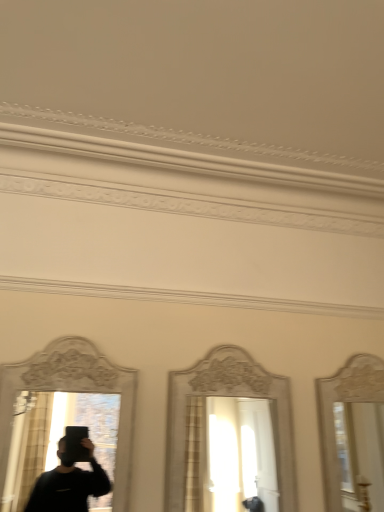
Question: Relative to matte white mirror at left, positioned as the 1th mirror in left-to-right order, is white glossy mirror at center, the second mirror positioned from the left, in front or behind?

Choices:
 (A) front
 (B) behind

Answer: (B)

Question: From a real-world perspective, relative to matte white mirror at left, which is counted as the 2th mirror, starting from the right, is white glossy mirror at center, marked as the 1th mirror in a right-to-left arrangement, vertically above or below?

Choices:
 (A) below
 (B) above

Answer: (A)

Question: Considering the positions of white glossy mirror at center, marked as the 1th mirror in a right-to-left arrangement, and matte white mirror at left, positioned as the 1th mirror in left-to-right order, in the image, is white glossy mirror at center, marked as the 1th mirror in a right-to-left arrangement, wider or thinner than matte white mirror at left, positioned as the 1th mirror in left-to-right order,?

Choices:
 (A) wide
 (B) thin

Answer: (A)

Question: From the image's perspective, is matte white mirror at left, positioned as the 1th mirror in left-to-right order, above or below white glossy mirror at center, the second mirror positioned from the left?

Choices:
 (A) above
 (B) below

Answer: (A)

Question: Considering the positions of matte white mirror at left, positioned as the 1th mirror in left-to-right order, and white glossy mirror at center, the second mirror positioned from the left, in the image, is matte white mirror at left, positioned as the 1th mirror in left-to-right order, wider or thinner than white glossy mirror at center, the second mirror positioned from the left,?

Choices:
 (A) thin
 (B) wide

Answer: (A)

Question: Based on their sizes in the image, would you say matte white mirror at left, positioned as the 1th mirror in left-to-right order, is bigger or smaller than white glossy mirror at center, the second mirror positioned from the left?

Choices:
 (A) small
 (B) big

Answer: (A)

Question: Considering the relative positions of matte white mirror at left, which is counted as the 2th mirror, starting from the right, and white glossy mirror at center, the second mirror positioned from the left, in the image provided, is matte white mirror at left, which is counted as the 2th mirror, starting from the right, to the left or to the right of white glossy mirror at center, the second mirror positioned from the left,?

Choices:
 (A) right
 (B) left

Answer: (B)